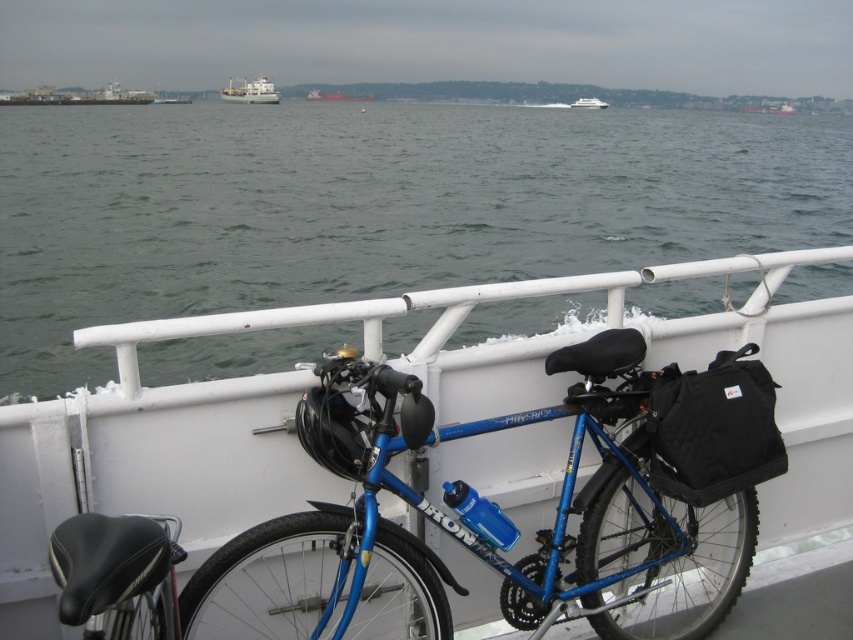
Who is positioned more to the right, brown wooden boat at center or white glossy boat at upper center?

white glossy boat at upper center is more to the right.

Who is more distant from viewer, [364,99] or [601,106]?

The point [601,106] is more distant.

Is point (347, 96) positioned in front of point (576, 102)?

Yes, point (347, 96) is in front of point (576, 102).

You are a GUI agent. You are given a task and a screenshot of the screen. Output one action in this format:
    pyautogui.click(x=<x>, y=<y>)
    Task: Click on the brown wooden boat at center
    
    Given the screenshot: What is the action you would take?
    pyautogui.click(x=335, y=97)

Who is higher up, blue metallic bicycle at center or white glossy boat at upper center?

Positioned higher is white glossy boat at upper center.

Is point (689, 496) positioned after point (601, 99)?

That is False.

The image size is (853, 640). In order to click on blue metallic bicycle at center in this screenshot , I will do `click(506, 516)`.

Does gray water at center appear under white matte cargo ship at upper center?

Indeed, gray water at center is positioned under white matte cargo ship at upper center.

Identify the location of gray water at center. Image resolution: width=853 pixels, height=640 pixels. (372, 205).

Does point (610, 220) come behind point (245, 96)?

No, it is not.

Image resolution: width=853 pixels, height=640 pixels. In order to click on gray water at center in this screenshot , I will do `click(372, 205)`.